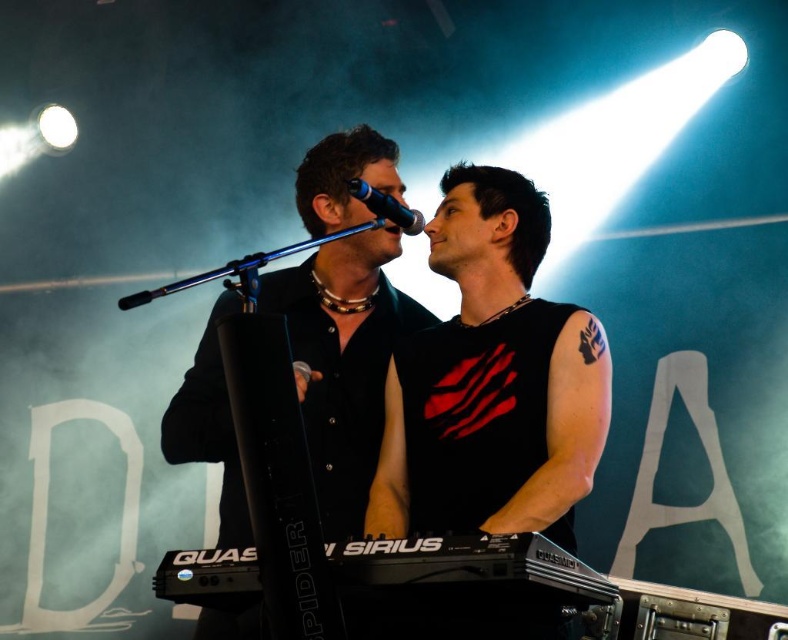
Consider the image. You are designing a stage backdrop that needs to accommodate both the black matte tank top at center and the black metallic microphone at upper center. Which object requires a wider space for placement?

The black matte tank top at center requires a wider space because its width surpasses that of the black metallic microphone at upper center.

You are designing a poster for the concert and need to ensure the black matte tank top at center and the black metallic microphone at upper center are scaled appropriately. Based on the scene, which object should be depicted as larger in the poster to maintain accuracy?

The black matte tank top at center should be depicted as larger in the poster since it is larger in size than the black metallic microphone at upper center according to the description.